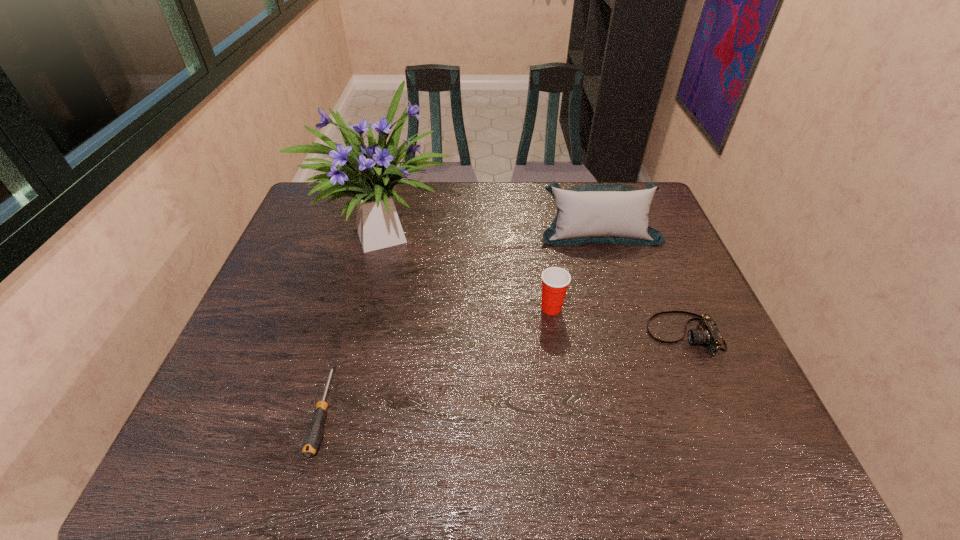
This screenshot has width=960, height=540. In order to click on free space located on the front-facing side of the camera in this screenshot , I will do `click(599, 334)`.

Identify the location of free space located 0.050m on the front-facing side of the camera. (628, 334).

I want to click on vacant space located on the left of the screwdriver, so click(x=287, y=410).

Identify the location of flower arrangement present at the far edge. The width and height of the screenshot is (960, 540). (369, 174).

The image size is (960, 540). I want to click on cushion at the far edge, so click(x=591, y=213).

The image size is (960, 540). I want to click on object that is positioned at the near edge, so click(x=313, y=435).

Locate an element on the screen. This screenshot has height=540, width=960. object located in the left edge section of the desktop is located at coordinates (369, 174).

This screenshot has height=540, width=960. I want to click on cushion at the right edge, so click(591, 213).

This screenshot has width=960, height=540. In order to click on camera located at the right edge in this screenshot , I will do `click(707, 333)`.

Where is `object present at the far left corner`? Image resolution: width=960 pixels, height=540 pixels. object present at the far left corner is located at coordinates (369, 174).